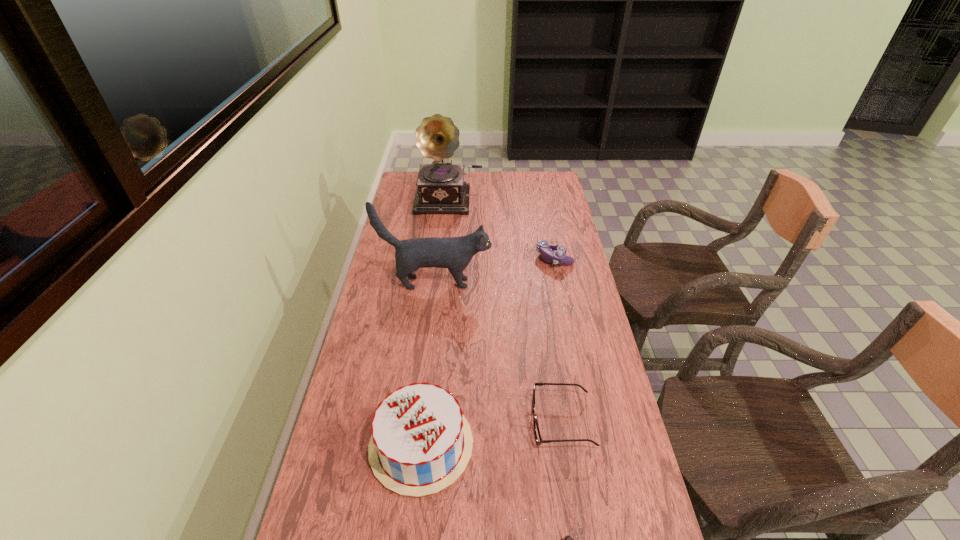
The width and height of the screenshot is (960, 540). In order to click on free space located 0.120m on the front-facing side of the farther spectacles in this screenshot , I will do `click(486, 422)`.

I want to click on free space located 0.310m on the front-facing side of the farther spectacles, so coord(413,422).

Where is `vacant area located on the front-facing side of the farther spectacles`? vacant area located on the front-facing side of the farther spectacles is located at coordinates (447, 422).

Locate an element on the screen. object that is positioned at the far edge is located at coordinates point(441,188).

This screenshot has width=960, height=540. I want to click on record player at the left edge, so click(x=441, y=188).

You are a GUI agent. You are given a task and a screenshot of the screen. Output one action in this format:
    pyautogui.click(x=<x>, y=<y>)
    Task: Click on the cat that is positioned at the left edge
    The width and height of the screenshot is (960, 540).
    Given the screenshot: What is the action you would take?
    pyautogui.click(x=455, y=253)

Identify the location of birthday cake situated at the left edge. (421, 442).

Where is `control at the right edge`? The width and height of the screenshot is (960, 540). control at the right edge is located at coordinates [547, 249].

You are a GUI agent. You are given a task and a screenshot of the screen. Output one action in this format:
    pyautogui.click(x=<x>, y=<y>)
    Task: Click on the spectacles located in the right edge section of the desktop
    The width and height of the screenshot is (960, 540).
    Given the screenshot: What is the action you would take?
    [537, 434]

What are the coordinates of `object at the far left corner` in the screenshot? It's located at (441, 188).